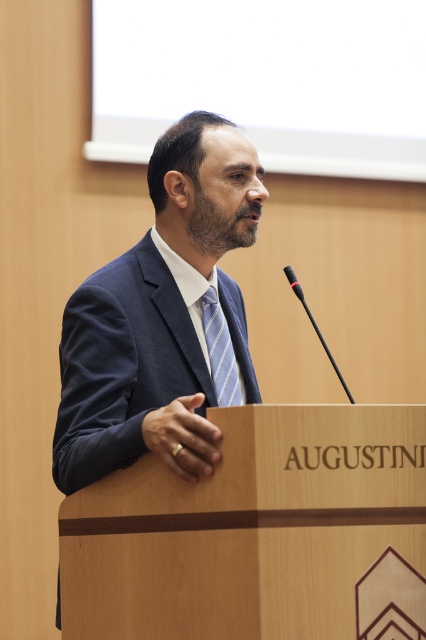
Which of these two, dark blue suit at center or striped fabric tie at center, stands shorter?

striped fabric tie at center is shorter.

Who is higher up, dark blue suit at center or striped fabric tie at center?

striped fabric tie at center

Find the location of `dark blue suit at center`. dark blue suit at center is located at coordinates (155, 323).

What do you see at coordinates (219, 349) in the screenshot? I see `striped fabric tie at center` at bounding box center [219, 349].

Between striped fabric tie at center and black matte microphone at center, which one has less height?

Standing shorter between the two is striped fabric tie at center.

Does point (224, 380) lie in front of point (327, 353)?

No, (224, 380) is behind (327, 353).

Find the location of a particular element. striped fabric tie at center is located at coordinates (219, 349).

Who is more distant from viewer, (189, 440) or (339, 381)?

The point (339, 381) is behind.

Can you confirm if dark blue suit at center is shorter than black matte microphone at center?

No, dark blue suit at center is not shorter than black matte microphone at center.

Find the location of a particular element. Image resolution: width=426 pixels, height=640 pixels. dark blue suit at center is located at coordinates (155, 323).

Where is `dark blue suit at center`? This screenshot has height=640, width=426. dark blue suit at center is located at coordinates (155, 323).